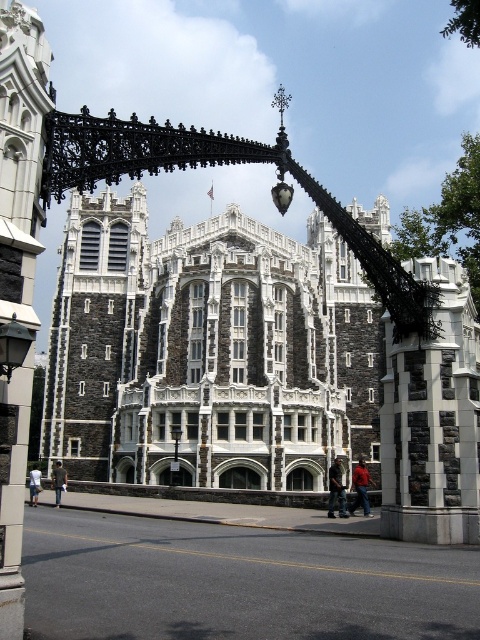
Between red leather jacket at lower right and light blue denim shorts at lower left, which one has more height?

red leather jacket at lower right is taller.

Is red leather jacket at lower right to the right of light blue denim shorts at lower left from the viewer's perspective?

Correct, you'll find red leather jacket at lower right to the right of light blue denim shorts at lower left.

Locate an element on the screen. red leather jacket at lower right is located at coordinates (360, 488).

Who is lower down, dark gray stone tower at center or red leather jacket at lower right?

red leather jacket at lower right is lower down.

What are the coordinates of `dark gray stone tower at center` in the screenshot? It's located at (94, 326).

Locate an element on the screen. dark gray stone tower at center is located at coordinates (94, 326).

Is point (367, 516) closer to camera compared to point (55, 465)?

Yes, it is in front of point (55, 465).

Is red leather jacket at lower right to the left of dark gray jacket at center from the viewer's perspective?

Incorrect, red leather jacket at lower right is not on the left side of dark gray jacket at center.

What do you see at coordinates (360, 488) in the screenshot? The height and width of the screenshot is (640, 480). I see `red leather jacket at lower right` at bounding box center [360, 488].

Locate an element on the screen. The width and height of the screenshot is (480, 640). red leather jacket at lower right is located at coordinates (360, 488).